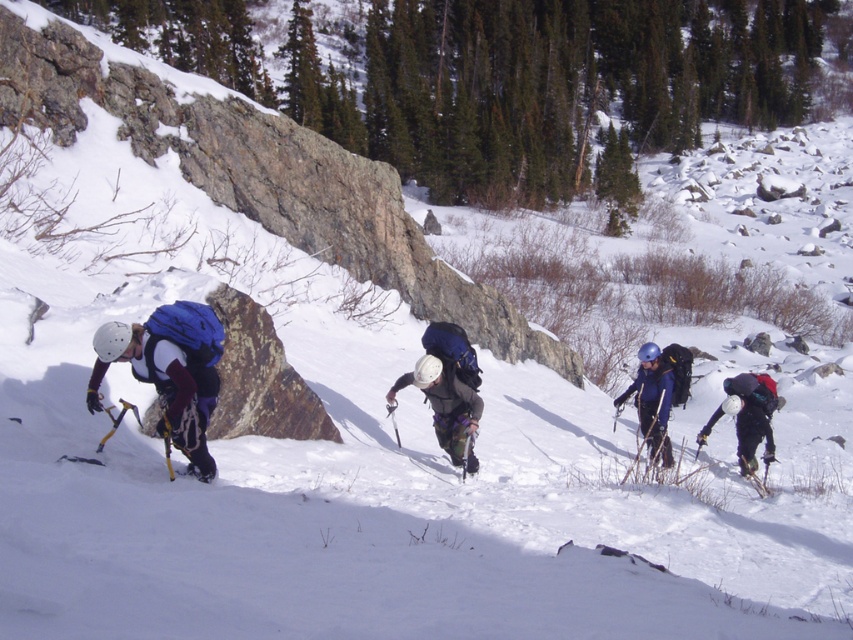
You are a photographer positioned at the center of the image. You want to capture a photo that includes the matte black backpack at lower right. Which direction should you move to ensure the backpack is in the frame?

The matte black backpack at lower right is located at point (747,416) in the image. Since you are at the center, moving towards the lower right direction will keep the backpack within the frame.

You are a drone operator tasked with capturing aerial footage of the ice climbing scene. The drone must hover directly above the matte white helmet at center to ensure clear visibility. What are the coordinates where the drone should position itself?

The drone should position itself at coordinates point (445, 404) to hover directly above the matte white helmet at center as specified in the description.

You are an ice climber looking at the scene. You see a matte blue jacket at left and a matte black backpack at lower right. Which object is positioned more to the left side of the image?

The matte blue jacket at left is positioned more to the left side of the image than the matte black backpack at lower right.